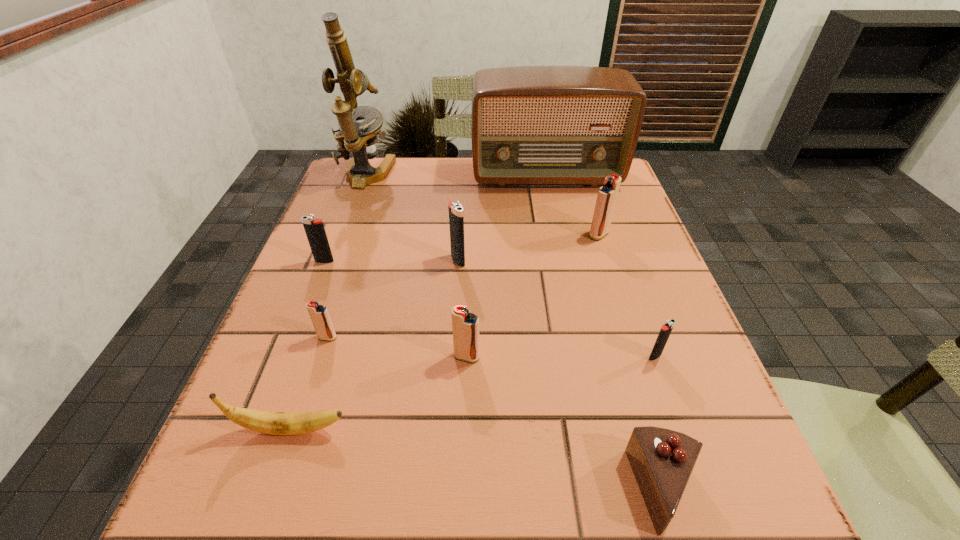
This screenshot has width=960, height=540. What are the coordinates of `free space at the far left corner of the desktop` in the screenshot? It's located at (354, 199).

Find the location of a particular element. vacant area at the near left corner is located at coordinates (276, 481).

Where is `vacant space at the far right corner of the desktop`? vacant space at the far right corner of the desktop is located at coordinates (623, 197).

At what (x,y) coordinates should I click in order to perform the action: click on free space between the nearest object and the second nearest object. Please return your answer as a coordinate pair (x, y). The height and width of the screenshot is (540, 960). Looking at the image, I should click on (478, 460).

This screenshot has height=540, width=960. Find the location of `vacant space that is in between the second farthest red igniter and the tallest object`. vacant space that is in between the second farthest red igniter and the tallest object is located at coordinates (347, 256).

You are a GUI agent. You are given a task and a screenshot of the screen. Output one action in this format:
    pyautogui.click(x=<x>, y=<y>)
    Task: Click on the unoccupied area between the radio receiver and the smallest red igniter
    The height and width of the screenshot is (540, 960).
    Given the screenshot: What is the action you would take?
    pyautogui.click(x=437, y=257)

Find the location of `vacant area that lies between the leftmost black igniter and the second smallest red igniter`. vacant area that lies between the leftmost black igniter and the second smallest red igniter is located at coordinates (396, 309).

What are the coordinates of `free spot between the second farthest red igniter and the leftmost igniter` in the screenshot? It's located at (326, 300).

Locate an element on the screen. Image resolution: width=960 pixels, height=540 pixels. free point between the rightmost red igniter and the second nearest red igniter is located at coordinates (x=463, y=286).

The height and width of the screenshot is (540, 960). In order to click on free space between the rightmost black igniter and the nearest object in this screenshot , I will do `click(660, 423)`.